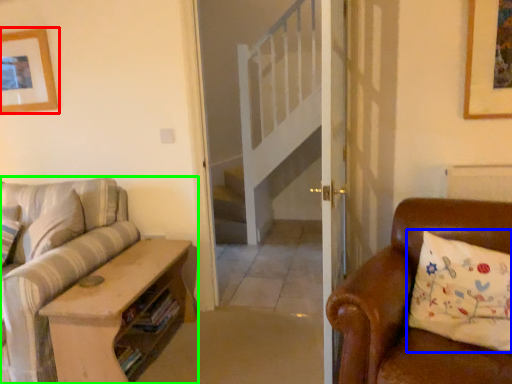
Question: Which is nearer to the picture frame (highlighted by a red box)? pillow (highlighted by a blue box) or studio couch (highlighted by a green box).

Choices:
 (A) pillow
 (B) studio couch

Answer: (B)